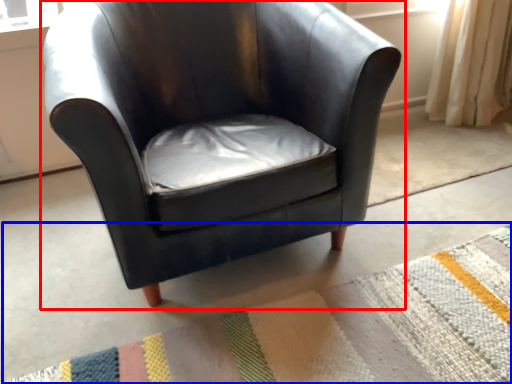
Question: Which of the following is the farthest to the observer, chair (highlighted by a red box) or mat (highlighted by a blue box)?

Choices:
 (A) chair
 (B) mat

Answer: (A)